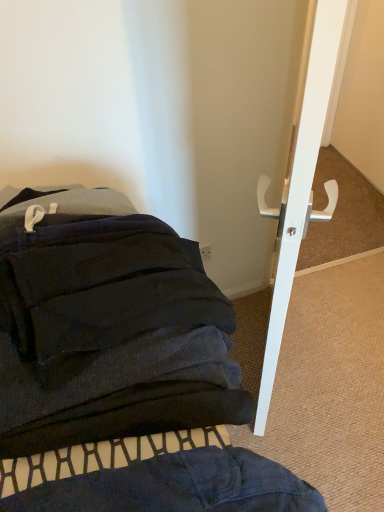
Describe the element at coordinates (107, 326) in the screenshot. This screenshot has height=512, width=384. I see `dark blue fabric at lower left` at that location.

Identify the location of dark blue fabric at lower left. This screenshot has width=384, height=512. (107, 326).

Describe the element at coordinates (301, 183) in the screenshot. The width and height of the screenshot is (384, 512). I see `white glossy door handle at upper right` at that location.

The image size is (384, 512). What are the coordinates of `white glossy door handle at upper right` in the screenshot? It's located at (301, 183).

At what (x,y) coordinates should I click in order to perform the action: click on dark blue fabric at lower left. Please return your answer as a coordinate pair (x, y). Looking at the image, I should click on (107, 326).

Is dark blue fabric at lower left to the left or to the right of white glossy door handle at upper right in the image?

In the image, dark blue fabric at lower left appears on the left side of white glossy door handle at upper right.

Considering their positions, is dark blue fabric at lower left located in front of or behind white glossy door handle at upper right?

dark blue fabric at lower left is positioned closer to the viewer than white glossy door handle at upper right.

Considering the points (40, 403) and (303, 227), which point is behind, point (40, 403) or point (303, 227)?

The point (303, 227) is farther from the camera.

From the picture: From the image's perspective, is dark blue fabric at lower left over white glossy door handle at upper right?

Incorrect, from the image's perspective, dark blue fabric at lower left is lower than white glossy door handle at upper right.

From a real-world perspective, relative to white glossy door handle at upper right, is dark blue fabric at lower left vertically above or below?

dark blue fabric at lower left is below white glossy door handle at upper right.

Considering the sizes of dark blue fabric at lower left and white glossy door handle at upper right in the image, is dark blue fabric at lower left wider or thinner than white glossy door handle at upper right?

dark blue fabric at lower left is wider than white glossy door handle at upper right.

Who is taller, dark blue fabric at lower left or white glossy door handle at upper right?

white glossy door handle at upper right.

Is dark blue fabric at lower left smaller than white glossy door handle at upper right?

Actually, dark blue fabric at lower left might be larger than white glossy door handle at upper right.

Is dark blue fabric at lower left surrounding white glossy door handle at upper right?

No, white glossy door handle at upper right is not surrounded by dark blue fabric at lower left.

Would you say dark blue fabric at lower left is a long distance from white glossy door handle at upper right?

That's not correct — dark blue fabric at lower left is a little close to white glossy door handle at upper right.

Is dark blue fabric at lower left oriented away from white glossy door handle at upper right?

dark blue fabric at lower left does not have its back to white glossy door handle at upper right.

At what (x,y) coordinates should I click in order to perform the action: click on door positioned vertically above the dark blue fabric at lower left (from a real-world perspective). Please return your answer as a coordinate pair (x, y). The height and width of the screenshot is (512, 384). Looking at the image, I should click on (301, 183).

Between white glossy door handle at upper right and dark blue fabric at lower left, which one appears on the left side from the viewer's perspective?

From the viewer's perspective, dark blue fabric at lower left appears more on the left side.

Which is in front, white glossy door handle at upper right or dark blue fabric at lower left?

dark blue fabric at lower left.

Does point (306, 139) lie in front of point (81, 301)?

That is True.

From the image's perspective, is white glossy door handle at upper right above or below dark blue fabric at lower left?

white glossy door handle at upper right is situated higher than dark blue fabric at lower left in the image.

From a real-world perspective, is white glossy door handle at upper right physically above dark blue fabric at lower left?

Yes, from a real-world perspective, white glossy door handle at upper right is above dark blue fabric at lower left.

Considering the sizes of white glossy door handle at upper right and dark blue fabric at lower left in the image, is white glossy door handle at upper right wider or thinner than dark blue fabric at lower left?

white glossy door handle at upper right is thinner than dark blue fabric at lower left.

Who is taller, white glossy door handle at upper right or dark blue fabric at lower left?

Standing taller between the two is white glossy door handle at upper right.

Between white glossy door handle at upper right and dark blue fabric at lower left, which one has smaller size?

Smaller between the two is white glossy door handle at upper right.

Is white glossy door handle at upper right not inside dark blue fabric at lower left?

Yes, white glossy door handle at upper right is not within dark blue fabric at lower left.

Are white glossy door handle at upper right and dark blue fabric at lower left beside each other?

white glossy door handle at upper right and dark blue fabric at lower left are clearly separated.

Is white glossy door handle at upper right positioned with its back to dark blue fabric at lower left?

No, white glossy door handle at upper right's orientation is not away from dark blue fabric at lower left.

Image resolution: width=384 pixels, height=512 pixels. In order to click on door above the dark blue fabric at lower left (from a real-world perspective) in this screenshot , I will do `click(301, 183)`.

In the image, there is a white glossy door handle at upper right. Where is `furniture below it (from a real-world perspective)`? The image size is (384, 512). furniture below it (from a real-world perspective) is located at coordinates (107, 326).

There is a dark blue fabric at lower left. At what (x,y) coordinates should I click in order to perform the action: click on door above it (from a real-world perspective). Please return your answer as a coordinate pair (x, y). Looking at the image, I should click on (301, 183).